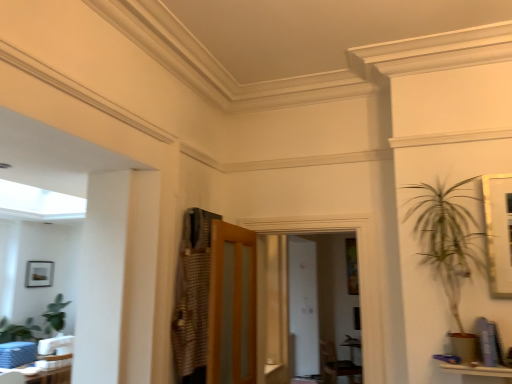
Identify the location of dark brown leather armchair at center. The image size is (512, 384). (335, 365).

Measure the distance between checkered fabric armoire at center and camera.

2.41 meters.

Describe the element at coordinates (39, 274) in the screenshot. I see `matte black picture frame at left` at that location.

Identify the location of wooden frosted glass door at center. This screenshot has width=512, height=384. (232, 306).

Identify the location of dark brown leather armchair at center. This screenshot has width=512, height=384. (335, 365).

Is matte black picture frame at left not within dark brown leather armchair at center?

Indeed, matte black picture frame at left is completely outside dark brown leather armchair at center.

Is matte black picture frame at left facing towards dark brown leather armchair at center?

No, matte black picture frame at left is not oriented towards dark brown leather armchair at center.

Locate an element on the screen. armchair below the matte black picture frame at left (from a real-world perspective) is located at coordinates (335, 365).

In terms of width, does matte black picture frame at left look wider or thinner when compared to dark brown leather armchair at center?

Considering their sizes, matte black picture frame at left looks slimmer than dark brown leather armchair at center.

Would you consider wooden frosted glass door at center to be distant from white glossy table at lower left?

Yes, wooden frosted glass door at center and white glossy table at lower left are quite far apart.

Is wooden frosted glass door at center positioned behind white glossy table at lower left?

No, wooden frosted glass door at center is closer to the camera.

From the picture: From the image's perspective, is wooden frosted glass door at center above white glossy table at lower left?

Indeed, from the image's perspective, wooden frosted glass door at center is shown above white glossy table at lower left.

Based on the photo, can you tell me how much wooden frosted glass door at center and white glossy table at lower left differ in facing direction?

There is a 176-degree angle between the facing directions of wooden frosted glass door at center and white glossy table at lower left.

Is dark brown leather armchair at center not inside checkered fabric armoire at center?

That's correct, dark brown leather armchair at center is outside of checkered fabric armoire at center.

Would you consider dark brown leather armchair at center to be distant from checkered fabric armoire at center?

dark brown leather armchair at center is far away from checkered fabric armoire at center.

Which is farther from the camera, (334, 360) or (205, 338)?

Positioned behind is point (334, 360).

Are checkered fabric armoire at center and white glossy table at lower left making contact?

No.

Considering the positions of objects checkered fabric armoire at center and white glossy table at lower left in the image provided, who is more to the left, checkered fabric armoire at center or white glossy table at lower left?

Positioned to the left is white glossy table at lower left.

From the image's perspective, is checkered fabric armoire at center located above or below white glossy table at lower left?

From the image's perspective, checkered fabric armoire at center appears above white glossy table at lower left.

Which of these two, wooden frosted glass door at center or dark brown leather armchair at center, is wider?

With larger width is dark brown leather armchair at center.

Image resolution: width=512 pixels, height=384 pixels. Identify the location of door in front of the dark brown leather armchair at center. (232, 306).

Can you see wooden frosted glass door at center touching dark brown leather armchair at center?

They are not placed beside each other.

Are checkered fabric armoire at center and matte black picture frame at left beside each other?

No, checkered fabric armoire at center is not next to matte black picture frame at left.

What's the angular difference between checkered fabric armoire at center and matte black picture frame at left's facing directions?

The angular difference between checkered fabric armoire at center and matte black picture frame at left is 86.5 degrees.

Where is `picture frame on the left of the checkered fabric armoire at center`? picture frame on the left of the checkered fabric armoire at center is located at coordinates (39, 274).

Can you confirm if checkered fabric armoire at center is positioned to the left of matte black picture frame at left?

Incorrect, checkered fabric armoire at center is not on the left side of matte black picture frame at left.

Choose the correct answer: Is matte black picture frame at left inside wooden frosted glass door at center or outside it?

matte black picture frame at left exists outside the volume of wooden frosted glass door at center.

From a real-world perspective, which is physically below, matte black picture frame at left or wooden frosted glass door at center?

From a 3D spatial view, wooden frosted glass door at center is below.

Are matte black picture frame at left and wooden frosted glass door at center making contact?

No, matte black picture frame at left is not in contact with wooden frosted glass door at center.

Where is `door above the matte black picture frame at left (from the image's perspective)`? This screenshot has width=512, height=384. door above the matte black picture frame at left (from the image's perspective) is located at coordinates (232, 306).

I want to click on picture frame located above the dark brown leather armchair at center (from the image's perspective), so click(39, 274).

This screenshot has width=512, height=384. There is a white glossy table at lower left. Identify the location of door above it (from a real-world perspective). (232, 306).

Estimate the real-world distances between objects in this image. Which object is further from white glossy table at lower left, matte black picture frame at left or checkered fabric armoire at center?

The object further to white glossy table at lower left is matte black picture frame at left.

From the image, which object appears to be nearer to white glossy table at lower left, checkered fabric armoire at center or dark brown leather armchair at center?

Based on the image, checkered fabric armoire at center appears to be nearer to white glossy table at lower left.

Estimate the real-world distances between objects in this image. Which object is further from matte black picture frame at left, checkered fabric armoire at center or dark brown leather armchair at center?

Among the two, checkered fabric armoire at center is located further to matte black picture frame at left.

Estimate the real-world distances between objects in this image. Which object is further from matte black picture frame at left, wooden frosted glass door at center or white glossy table at lower left?

The object further to matte black picture frame at left is wooden frosted glass door at center.

When comparing their distances from wooden frosted glass door at center, does dark brown leather armchair at center or matte black picture frame at left seem further?

Based on the image, matte black picture frame at left appears to be further to wooden frosted glass door at center.

Looking at this image, based on their spatial positions, is dark brown leather armchair at center or checkered fabric armoire at center further from matte black picture frame at left?

Based on the image, checkered fabric armoire at center appears to be further to matte black picture frame at left.

Estimate the real-world distances between objects in this image. Which object is closer to white glossy table at lower left, dark brown leather armchair at center or matte black picture frame at left?

The object closer to white glossy table at lower left is matte black picture frame at left.

When comparing their distances from white glossy table at lower left, does dark brown leather armchair at center or wooden frosted glass door at center seem closer?

Based on the image, wooden frosted glass door at center appears to be nearer to white glossy table at lower left.

You are a GUI agent. You are given a task and a screenshot of the screen. Output one action in this format:
    pyautogui.click(x=<x>, y=<y>)
    Task: Click on the armoire between matte black picture frame at left and dark brown leather armchair at center from left to right
    The width and height of the screenshot is (512, 384).
    Given the screenshot: What is the action you would take?
    pyautogui.click(x=192, y=297)

I want to click on door between matte black picture frame at left and dark brown leather armchair at center, so click(232, 306).

You are a GUI agent. You are given a task and a screenshot of the screen. Output one action in this format:
    pyautogui.click(x=<x>, y=<y>)
    Task: Click on the armoire located between wooden frosted glass door at center and matte black picture frame at left in the depth direction
    This screenshot has width=512, height=384.
    Given the screenshot: What is the action you would take?
    pyautogui.click(x=192, y=297)

At what (x,y) coordinates should I click in order to perform the action: click on armoire positioned between wooden frosted glass door at center and dark brown leather armchair at center from near to far. Please return your answer as a coordinate pair (x, y). Looking at the image, I should click on tap(192, 297).